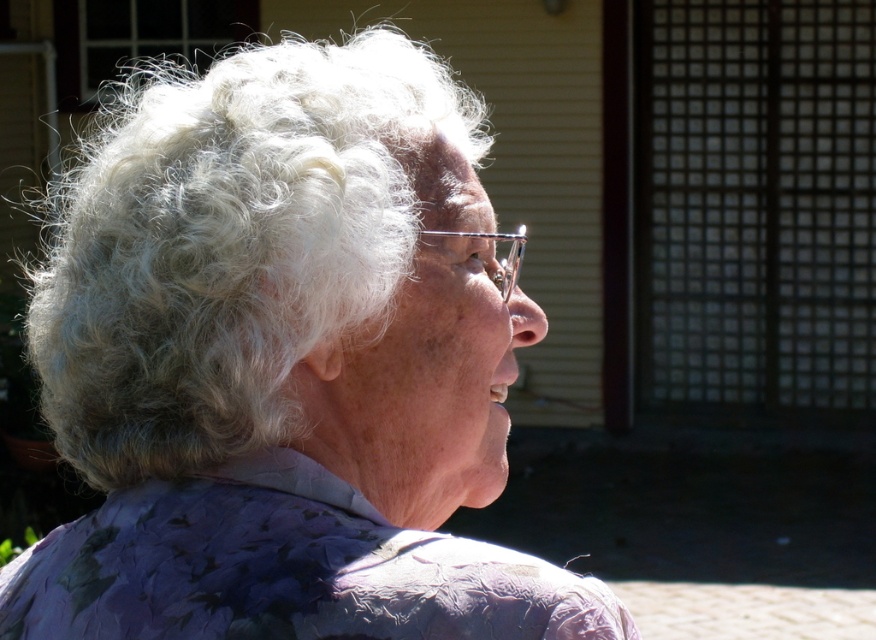
You are an interior designer assessing the spatial arrangement of a client who wants to place a wide decorative item on their wall. The client has two options in the image provided, the white curly hair at upper left and the purple floral fabric at lower center. Which object would you recommend for the decorative item if the wall space is narrow?

The white curly hair at upper left has a lesser width compared to the purple floral fabric at lower center, so it would be more suitable for a narrow wall space.

You are a photographer adjusting your camera settings to capture the contrast between the white curly hair at upper left and the purple floral fabric at lower center. Which object is positioned higher in the frame?

The white curly hair at upper left is positioned higher in the frame than the purple floral fabric at lower center because it is much taller as purple floral fabric at lower center.